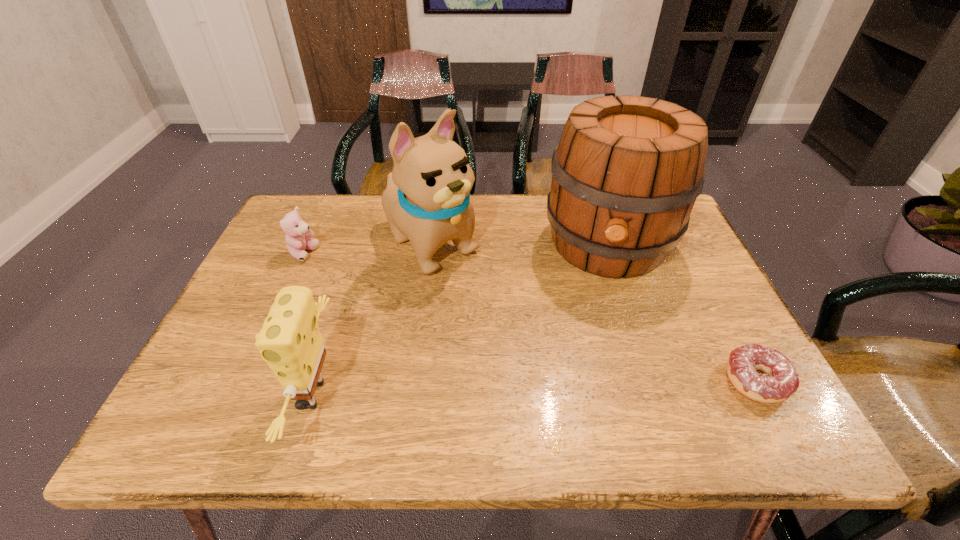
Locate an element on the screen. The height and width of the screenshot is (540, 960). cider situated at the far edge is located at coordinates (626, 173).

At what (x,y) coordinates should I click in order to perform the action: click on puppy that is positioned at the far edge. Please return your answer as a coordinate pair (x, y). This screenshot has height=540, width=960. Looking at the image, I should click on (427, 199).

This screenshot has height=540, width=960. Find the location of `sponge that is at the near edge`. sponge that is at the near edge is located at coordinates (290, 342).

Where is `doughnut located at the near edge`? This screenshot has width=960, height=540. doughnut located at the near edge is located at coordinates (781, 380).

The image size is (960, 540). What are the coordinates of `object positioned at the left edge` in the screenshot? It's located at (297, 231).

Where is `doughnut that is at the right edge`? doughnut that is at the right edge is located at coordinates (781, 380).

The width and height of the screenshot is (960, 540). I want to click on cider located at the right edge, so click(626, 173).

The image size is (960, 540). Find the location of `object that is at the far right corner`. object that is at the far right corner is located at coordinates (626, 173).

You are a GUI agent. You are given a task and a screenshot of the screen. Output one action in this format:
    pyautogui.click(x=<x>, y=<y>)
    Task: Click on the object at the near right corner
    The image size is (960, 540).
    Given the screenshot: What is the action you would take?
    pyautogui.click(x=781, y=380)

This screenshot has width=960, height=540. What are the coordinates of `vacant space at the far edge of the desktop` in the screenshot? It's located at click(x=358, y=200).